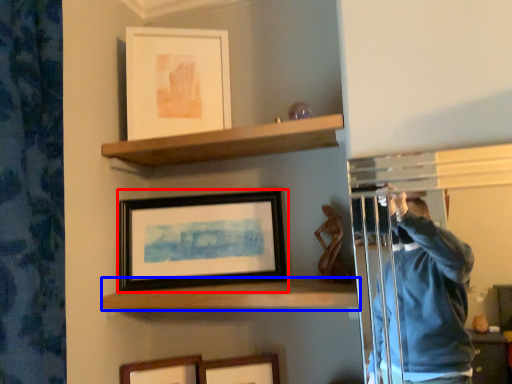
Question: Which object appears closest to the camera in this image, picture frame (highlighted by a red box) or shelf (highlighted by a blue box)?

Choices:
 (A) picture frame
 (B) shelf

Answer: (B)